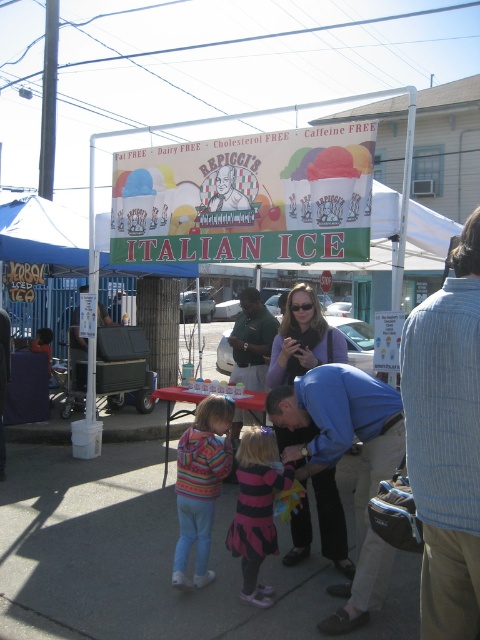
You are a customer at the Italian Ice stand and want to hand the cashier your payment. You notice both the blue cotton shirt at center and the striped sweater at center. Which clothing item is closer to you to reach out to?

The blue cotton shirt at center is closer to the viewer than the striped sweater at center, so you should reach out to the cashier wearing the blue cotton shirt at center.